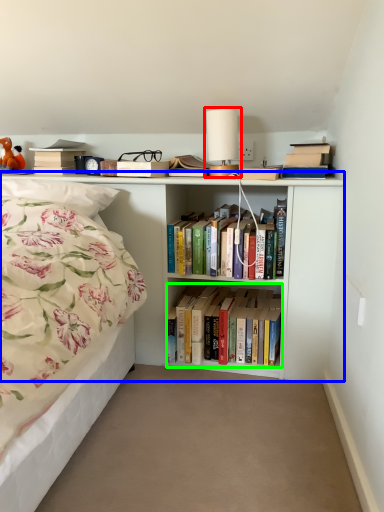
Question: Which object is positioned farthest from table lamp (highlighted by a red box)? Select from bookcase (highlighted by a blue box) and book (highlighted by a green box).

Choices:
 (A) bookcase
 (B) book

Answer: (B)